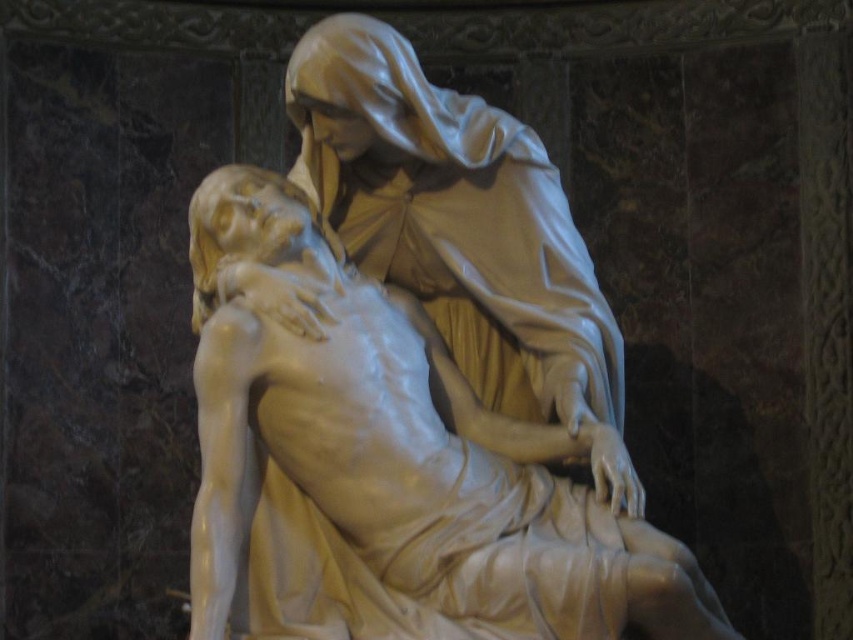
You are an art conservator working in a gallery. You need to move the white marble statue at center and the matte white statue at center to a new exhibition space. The gallery has a 4.5 meter wide door. Can both statues be moved through the door at the same time if placed side by side?

The distance between the white marble statue at center and matte white statue at center is 4.04 meters. Since the door is 4.5 meters wide, the two statues can be moved through the door side by side as their combined width is less than the door width.

You are a photographer standing at a certain distance from the white marble statue at center. You want to capture a clear photo of the statue without any distortion. The camera you are using has a maximum focus range of 50 meters. Can you take the photo from your current position?

The white marble statue at center and camera are 49.71 meters apart from each other. Since the camera can focus up to 50 meters, you can take the photo from your current position as the distance is within the focus range.